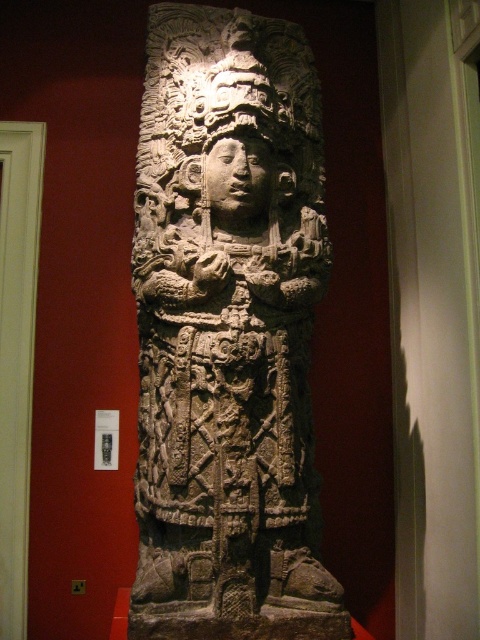
Question: Which of the following is the closest to the observer?

Choices:
 (A) dark gray stone sculpture at center
 (B) carved stone head at center

Answer: (A)

Question: Which of the following is the closest to the observer?

Choices:
 (A) (256, 102)
 (B) (251, 154)

Answer: (A)

Question: Can you confirm if dark gray stone sculpture at center is positioned above carved stone head at center?

Choices:
 (A) no
 (B) yes

Answer: (A)

Question: Among these points, which one is farthest from the camera?

Choices:
 (A) (202, 10)
 (B) (249, 180)

Answer: (A)

Question: Does dark gray stone sculpture at center come in front of carved stone head at center?

Choices:
 (A) no
 (B) yes

Answer: (B)

Question: Does dark gray stone sculpture at center have a larger size compared to carved stone head at center?

Choices:
 (A) yes
 (B) no

Answer: (A)